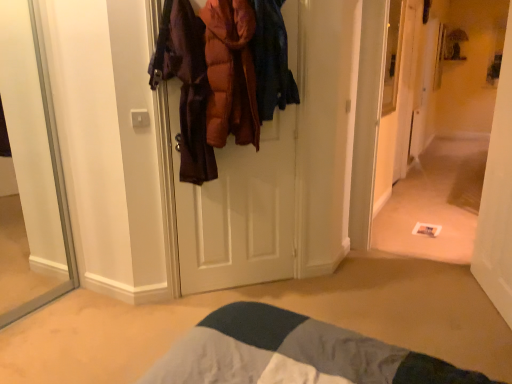
What is the approximate width of white carpet at center?

It is 2.05 inches.

Where is `white glossy door at center`? Image resolution: width=512 pixels, height=384 pixels. white glossy door at center is located at coordinates (498, 197).

In order to click on orange puffy jacket at center in this screenshot , I will do `click(230, 73)`.

There is a white glossy door at center. Where is `corridor above it (from a real-world perspective)`? corridor above it (from a real-world perspective) is located at coordinates (439, 134).

Is white carpet at center beside white glossy door at center?

white carpet at center and white glossy door at center are not in contact.

Can white glossy door at center be found inside white carpet at center?

No, white glossy door at center is not a part of white carpet at center.

How much distance is there between white carpet at center and white glossy door at center?

white carpet at center and white glossy door at center are 1.84 meters apart.

Based on the photo, considering the sizes of objects white glossy door at center and white carpet at center in the image provided, who is shorter, white glossy door at center or white carpet at center?

Standing shorter between the two is white glossy door at center.

Considering the sizes of white glossy door at center and white carpet at center in the image, is white glossy door at center bigger or smaller than white carpet at center?

Considering their sizes, white glossy door at center takes up more space than white carpet at center.

Which object is positioned more to the left, white glossy door at center or white carpet at center?

white carpet at center.

Is the position of white glossy door at center less distant than that of white carpet at center?

Yes, it is in front of white carpet at center.

How different are the orientations of white carpet at center and orange puffy jacket at center in degrees?

The angle between the facing direction of white carpet at center and the facing direction of orange puffy jacket at center is 45.4 degrees.

From the picture: Is white carpet at center smaller than orange puffy jacket at center?

Actually, white carpet at center might be larger than orange puffy jacket at center.

Would you say white carpet at center is outside orange puffy jacket at center?

Indeed, white carpet at center is completely outside orange puffy jacket at center.

Who is more distant, white carpet at center or orange puffy jacket at center?

white carpet at center.

Is orange puffy jacket at center oriented towards white carpet at center?

No, orange puffy jacket at center is not turned towards white carpet at center.

Considering the relative positions of orange puffy jacket at center and white carpet at center in the image provided, is orange puffy jacket at center to the right of white carpet at center from the viewer's perspective?

In fact, orange puffy jacket at center is to the left of white carpet at center.

Does point (221, 144) come farther from viewer compared to point (440, 103)?

No, it is not.

Locate an element on the screen. clothing that appears above the white carpet at center (from a real-world perspective) is located at coordinates (230, 73).

In the scene shown: From a real-world perspective, which object stands above the other?

In real-world perspective, orange puffy jacket at center is above.

Is white glossy door at center to the left or to the right of orange puffy jacket at center in the image?

white glossy door at center is positioned on orange puffy jacket at center's right side.

Consider the image. Is white glossy door at center inside or outside of orange puffy jacket at center?

white glossy door at center exists outside the volume of orange puffy jacket at center.

From the image's perspective, which one is positioned higher, orange puffy jacket at center or white glossy door at center?

From the image's view, orange puffy jacket at center is above.

Is orange puffy jacket at center looking in the opposite direction of white glossy door at center?

No, orange puffy jacket at center is not facing away from white glossy door at center.

Where is `corridor located on the left of white glossy door at center`? The image size is (512, 384). corridor located on the left of white glossy door at center is located at coordinates (439, 134).

What are the coordinates of `door lying below the white carpet at center (from the image's perspective)` in the screenshot? It's located at (498, 197).

Looking at the image, which one is located further to orange puffy jacket at center, white carpet at center or white glossy door at center?

Based on the image, white carpet at center appears to be further to orange puffy jacket at center.

From the image, which object appears to be nearer to white glossy door at center, orange puffy jacket at center or white carpet at center?

Based on the image, orange puffy jacket at center appears to be nearer to white glossy door at center.

Based on their spatial positions, is white glossy door at center or white carpet at center closer to orange puffy jacket at center?

white glossy door at center is closer to orange puffy jacket at center.

When comparing their distances from white glossy door at center, does white carpet at center or orange puffy jacket at center seem closer?

orange puffy jacket at center lies closer to white glossy door at center than the other object.

When comparing their distances from white carpet at center, does orange puffy jacket at center or white glossy door at center seem further?

orange puffy jacket at center.

From the image, which object appears to be farther from white carpet at center, white glossy door at center or orange puffy jacket at center?

orange puffy jacket at center is further to white carpet at center.

I want to click on corridor situated between orange puffy jacket at center and white glossy door at center from left to right, so click(439, 134).